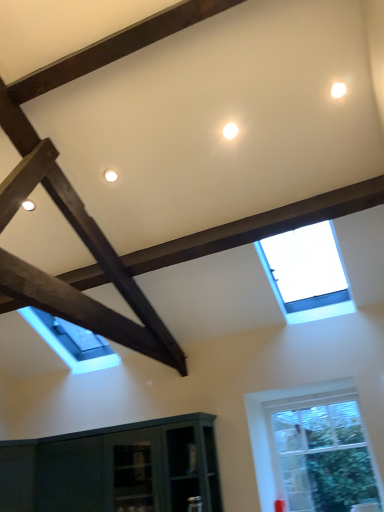
Describe the element at coordinates (313, 448) in the screenshot. I see `clear glass window at lower right, the second window in the top-to-bottom sequence` at that location.

The height and width of the screenshot is (512, 384). In order to click on clear glass window at lower right, the second window in the top-to-bottom sequence in this screenshot , I will do `click(313, 448)`.

What do you see at coordinates (306, 273) in the screenshot? The width and height of the screenshot is (384, 512). I see `transparent glass skylight at upper center, the 1th window from the top` at bounding box center [306, 273].

The height and width of the screenshot is (512, 384). Identify the location of transparent glass skylight at upper center, which is the second window in bottom-to-top order. (306, 273).

Locate an element on the screen. clear glass window at lower right, which is the 1th window in bottom-to-top order is located at coordinates (313, 448).

Which object is positioned more to the left, transparent glass skylight at upper center, the 1th window from the top, or clear glass window at lower right, which is the 1th window in bottom-to-top order?

transparent glass skylight at upper center, the 1th window from the top.

Does transparent glass skylight at upper center, which is the second window in bottom-to-top order, come in front of clear glass window at lower right, which is the 1th window in bottom-to-top order?

That is True.

Does point (291, 315) come in front of point (355, 475)?

No, it is behind (355, 475).

From the image's perspective, which object appears higher, transparent glass skylight at upper center, which is the second window in bottom-to-top order, or clear glass window at lower right, which is the 1th window in bottom-to-top order?

transparent glass skylight at upper center, which is the second window in bottom-to-top order, appears higher in the image.

In the scene shown: From a real-world perspective, who is located higher, transparent glass skylight at upper center, the 1th window from the top, or clear glass window at lower right, the second window in the top-to-bottom sequence?

From a 3D spatial view, transparent glass skylight at upper center, the 1th window from the top, is above.

Which of these two, transparent glass skylight at upper center, the 1th window from the top, or clear glass window at lower right, which is the 1th window in bottom-to-top order, is thinner?

clear glass window at lower right, which is the 1th window in bottom-to-top order.

Considering the relative sizes of transparent glass skylight at upper center, which is the second window in bottom-to-top order, and clear glass window at lower right, which is the 1th window in bottom-to-top order, in the image provided, is transparent glass skylight at upper center, which is the second window in bottom-to-top order, shorter than clear glass window at lower right, which is the 1th window in bottom-to-top order,?

Indeed, transparent glass skylight at upper center, which is the second window in bottom-to-top order, has a lesser height compared to clear glass window at lower right, which is the 1th window in bottom-to-top order.

Considering the relative sizes of transparent glass skylight at upper center, which is the second window in bottom-to-top order, and clear glass window at lower right, which is the 1th window in bottom-to-top order, in the image provided, is transparent glass skylight at upper center, which is the second window in bottom-to-top order, bigger than clear glass window at lower right, which is the 1th window in bottom-to-top order,?

Indeed, transparent glass skylight at upper center, which is the second window in bottom-to-top order, has a larger size compared to clear glass window at lower right, which is the 1th window in bottom-to-top order.

Is transparent glass skylight at upper center, the 1th window from the top, inside the boundaries of clear glass window at lower right, which is the 1th window in bottom-to-top order, or outside?

transparent glass skylight at upper center, the 1th window from the top, is located beyond the bounds of clear glass window at lower right, which is the 1th window in bottom-to-top order.

Is the surface of transparent glass skylight at upper center, which is the second window in bottom-to-top order, in direct contact with clear glass window at lower right, the second window in the top-to-bottom sequence?

No, transparent glass skylight at upper center, which is the second window in bottom-to-top order, is not in contact with clear glass window at lower right, the second window in the top-to-bottom sequence.

Is clear glass window at lower right, which is the 1th window in bottom-to-top order, at the back of transparent glass skylight at upper center, the 1th window from the top?

transparent glass skylight at upper center, the 1th window from the top, does not have its back to clear glass window at lower right, which is the 1th window in bottom-to-top order.

Can you tell me how much transparent glass skylight at upper center, the 1th window from the top, and clear glass window at lower right, which is the 1th window in bottom-to-top order, differ in facing direction?

The angle between the facing direction of transparent glass skylight at upper center, the 1th window from the top, and the facing direction of clear glass window at lower right, which is the 1th window in bottom-to-top order, is 0.851 degrees.

You are a GUI agent. You are given a task and a screenshot of the screen. Output one action in this format:
    pyautogui.click(x=<x>, y=<y>)
    Task: Click on the window below the transparent glass skylight at upper center, which is the second window in bottom-to-top order (from a real-world perspective)
    
    Given the screenshot: What is the action you would take?
    pyautogui.click(x=313, y=448)

Consider the image. Is clear glass window at lower right, the second window in the top-to-bottom sequence, at the left side of transparent glass skylight at upper center, the 1th window from the top?

No.

Considering the relative positions of clear glass window at lower right, which is the 1th window in bottom-to-top order, and transparent glass skylight at upper center, which is the second window in bottom-to-top order, in the image provided, is clear glass window at lower right, which is the 1th window in bottom-to-top order, behind transparent glass skylight at upper center, which is the second window in bottom-to-top order,?

Yes.

Considering the points (289, 394) and (312, 257), which point is in front, point (289, 394) or point (312, 257)?

The point (312, 257) is closer.

From the image's perspective, is clear glass window at lower right, which is the 1th window in bottom-to-top order, located above or below transparent glass skylight at upper center, the 1th window from the top?

Clearly, from the image's perspective, clear glass window at lower right, which is the 1th window in bottom-to-top order, is below transparent glass skylight at upper center, the 1th window from the top.

From a real-world perspective, which is physically above, clear glass window at lower right, the second window in the top-to-bottom sequence, or transparent glass skylight at upper center, the 1th window from the top?

transparent glass skylight at upper center, the 1th window from the top, from a real-world perspective.

Does clear glass window at lower right, the second window in the top-to-bottom sequence, have a greater width compared to transparent glass skylight at upper center, which is the second window in bottom-to-top order?

No.

Which of these two, clear glass window at lower right, which is the 1th window in bottom-to-top order, or transparent glass skylight at upper center, which is the second window in bottom-to-top order, stands shorter?

transparent glass skylight at upper center, which is the second window in bottom-to-top order, is shorter.

Between clear glass window at lower right, which is the 1th window in bottom-to-top order, and transparent glass skylight at upper center, which is the second window in bottom-to-top order, which one has smaller size?

Smaller between the two is clear glass window at lower right, which is the 1th window in bottom-to-top order.

Can transparent glass skylight at upper center, the 1th window from the top, be found inside clear glass window at lower right, the second window in the top-to-bottom sequence?

No, transparent glass skylight at upper center, the 1th window from the top, is located outside of clear glass window at lower right, the second window in the top-to-bottom sequence.

Is clear glass window at lower right, which is the 1th window in bottom-to-top order, positioned far away from transparent glass skylight at upper center, which is the second window in bottom-to-top order?

clear glass window at lower right, which is the 1th window in bottom-to-top order, is positioned a significant distance from transparent glass skylight at upper center, which is the second window in bottom-to-top order.

Is transparent glass skylight at upper center, which is the second window in bottom-to-top order, at the back of clear glass window at lower right, the second window in the top-to-bottom sequence?

No, clear glass window at lower right, the second window in the top-to-bottom sequence,'s orientation is not away from transparent glass skylight at upper center, which is the second window in bottom-to-top order.

How different are the orientations of clear glass window at lower right, which is the 1th window in bottom-to-top order, and transparent glass skylight at upper center, which is the second window in bottom-to-top order, in degrees?

0.851 degrees separate the facing orientations of clear glass window at lower right, which is the 1th window in bottom-to-top order, and transparent glass skylight at upper center, which is the second window in bottom-to-top order.

How distant is clear glass window at lower right, the second window in the top-to-bottom sequence, from transparent glass skylight at upper center, which is the second window in bottom-to-top order?

A distance of 1.09 meters exists between clear glass window at lower right, the second window in the top-to-bottom sequence, and transparent glass skylight at upper center, which is the second window in bottom-to-top order.

At what (x,y) coordinates should I click in order to perform the action: click on window above the clear glass window at lower right, which is the 1th window in bottom-to-top order (from a real-world perspective). Please return your answer as a coordinate pair (x, y). The width and height of the screenshot is (384, 512). Looking at the image, I should click on (306, 273).

This screenshot has width=384, height=512. Identify the location of window below the transparent glass skylight at upper center, which is the second window in bottom-to-top order (from a real-world perspective). (313, 448).

I want to click on window lying on the left of clear glass window at lower right, which is the 1th window in bottom-to-top order, so click(x=306, y=273).